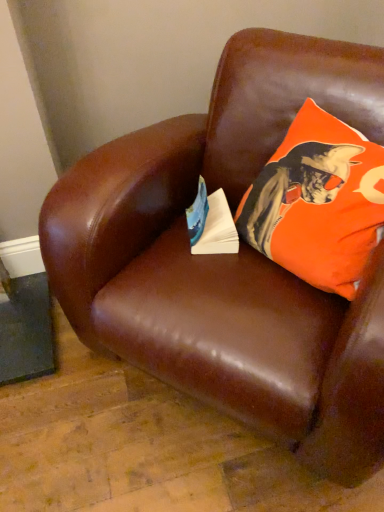
Question: Should I look upward or downward to see orange fabric pillow at upper right?

Choices:
 (A) down
 (B) up

Answer: (B)

Question: Can you confirm if white paper at center is smaller than orange fabric pillow at upper right?

Choices:
 (A) yes
 (B) no

Answer: (A)

Question: Could you tell me if white paper at center is turned towards orange fabric pillow at upper right?

Choices:
 (A) yes
 (B) no

Answer: (B)

Question: Does white paper at center appear on the left side of orange fabric pillow at upper right?

Choices:
 (A) yes
 (B) no

Answer: (A)

Question: Considering the relative positions of white paper at center and orange fabric pillow at upper right in the image provided, is white paper at center to the right of orange fabric pillow at upper right from the viewer's perspective?

Choices:
 (A) yes
 (B) no

Answer: (B)

Question: Is white paper at center bigger than orange fabric pillow at upper right?

Choices:
 (A) yes
 (B) no

Answer: (B)

Question: Is white paper at center wider than orange fabric pillow at upper right?

Choices:
 (A) no
 (B) yes

Answer: (A)

Question: Is orange fabric pillow at upper right oriented towards white paper at center?

Choices:
 (A) yes
 (B) no

Answer: (A)

Question: Is orange fabric pillow at upper right not near white paper at center?

Choices:
 (A) yes
 (B) no

Answer: (B)

Question: Does orange fabric pillow at upper right have a greater width compared to white paper at center?

Choices:
 (A) yes
 (B) no

Answer: (A)

Question: Is orange fabric pillow at upper right positioned beyond the bounds of white paper at center?

Choices:
 (A) yes
 (B) no

Answer: (A)

Question: From the image's perspective, would you say orange fabric pillow at upper right is shown under white paper at center?

Choices:
 (A) yes
 (B) no

Answer: (B)

Question: Is orange fabric pillow at upper right thinner than white paper at center?

Choices:
 (A) yes
 (B) no

Answer: (B)

Question: Is white paper at center inside the boundaries of orange fabric pillow at upper right, or outside?

Choices:
 (A) outside
 (B) inside

Answer: (A)